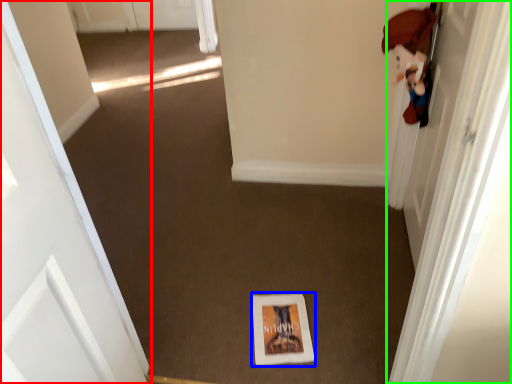
Question: Which object is positioned closest to door (highlighted by a red box)? Select from print (highlighted by a blue box) and door (highlighted by a green box).

Choices:
 (A) print
 (B) door

Answer: (A)